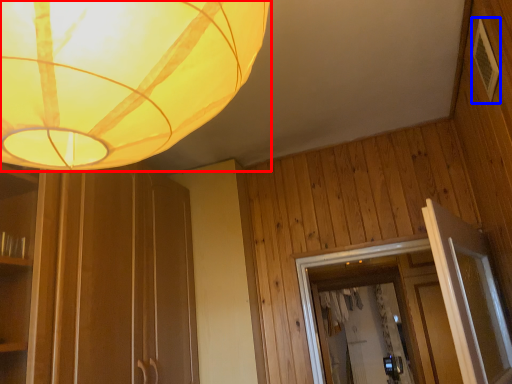
Question: Which object is further to the camera taking this photo, lamp (highlighted by a red box) or panel (highlighted by a blue box)?

Choices:
 (A) lamp
 (B) panel

Answer: (B)